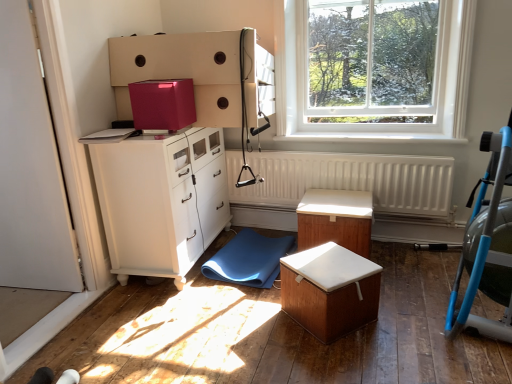
This screenshot has height=384, width=512. What are the coordinates of `empty space that is to the right of wooden box with white cushion at center, marked as the first table in a front-to-back arrangement` in the screenshot? It's located at pyautogui.click(x=403, y=321).